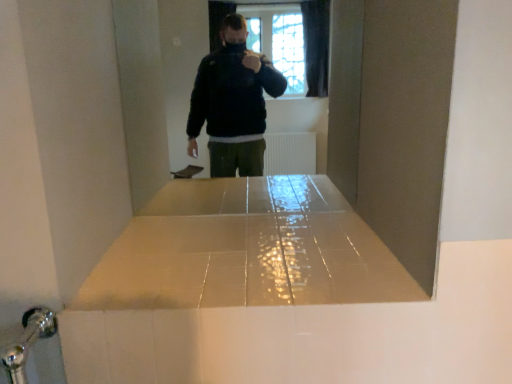
What is the approximate height of white glossy counter top at center?

white glossy counter top at center is 0.93 inches in height.

Describe the element at coordinates (246, 250) in the screenshot. I see `white glossy counter top at center` at that location.

Based on the photo, measure the distance between white glossy counter top at center and camera.

white glossy counter top at center is 35.52 inches from camera.

I want to click on white glossy counter top at center, so click(246, 250).

You are a GUI agent. You are given a task and a screenshot of the screen. Output one action in this format:
    pyautogui.click(x=<x>, y=<y>)
    Task: Click on the white glossy counter top at center
    
    Given the screenshot: What is the action you would take?
    pyautogui.click(x=246, y=250)